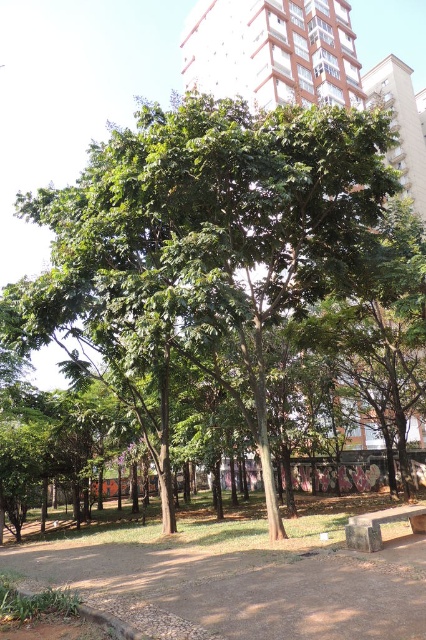
Is green leafy tree at center wider than stone bench at lower right?

Yes, green leafy tree at center is wider than stone bench at lower right.

Who is lower down, green leafy tree at center or stone bench at lower right?

Positioned lower is stone bench at lower right.

The height and width of the screenshot is (640, 426). What do you see at coordinates (207, 248) in the screenshot?
I see `green leafy tree at center` at bounding box center [207, 248].

Image resolution: width=426 pixels, height=640 pixels. Identify the location of green leafy tree at center. (207, 248).